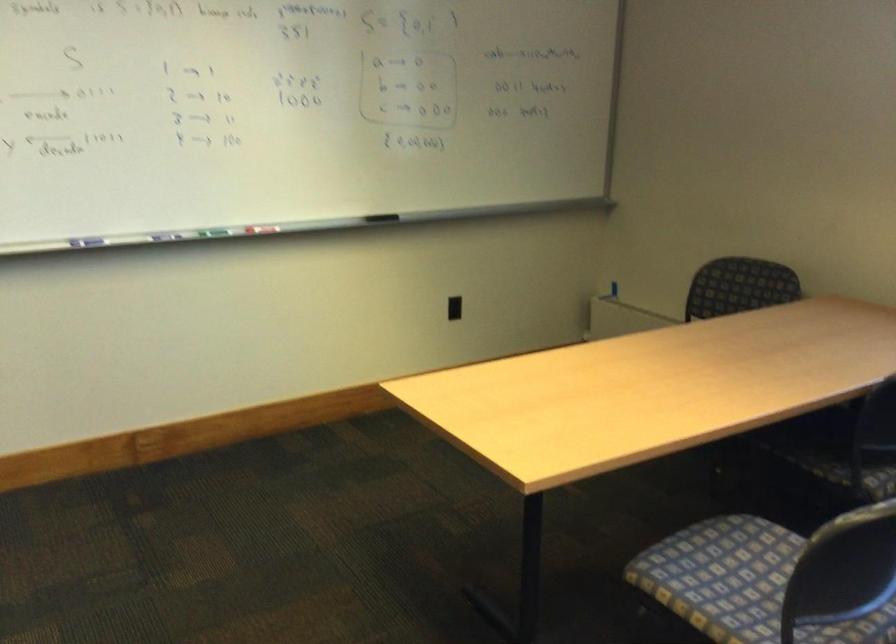
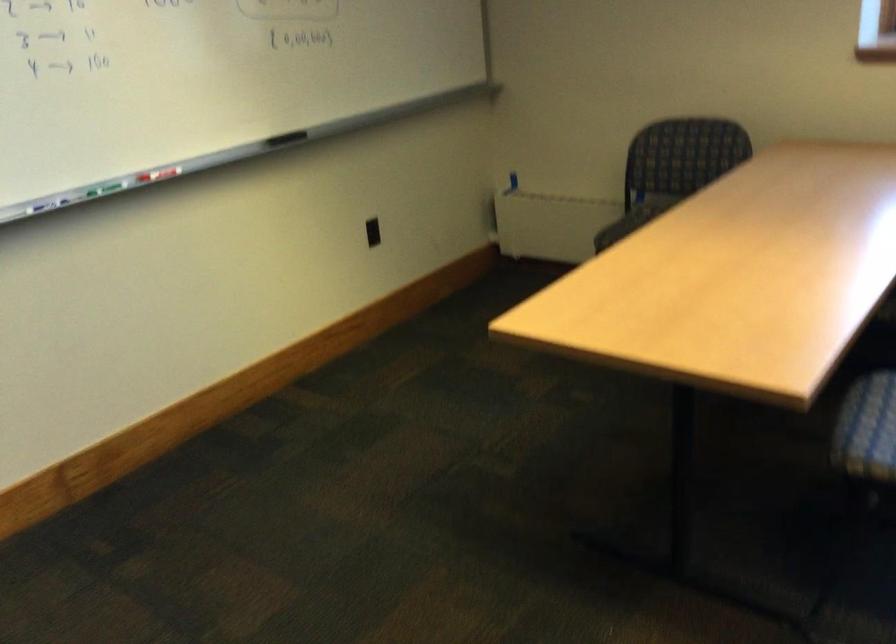
The point at (610, 288) is marked in the first image. Where is the corresponding point in the second image?

(513, 180)